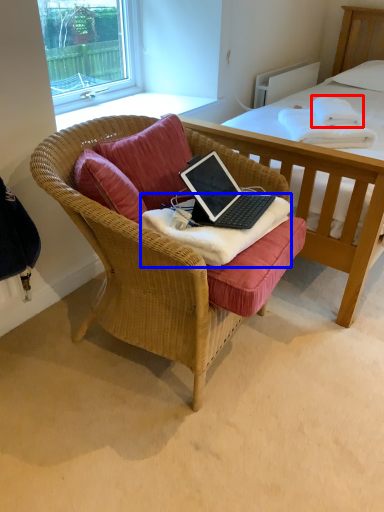
Question: Among these objects, which one is farthest to the camera, cloth (highlighted by a red box) or blanket (highlighted by a blue box)?

Choices:
 (A) cloth
 (B) blanket

Answer: (A)